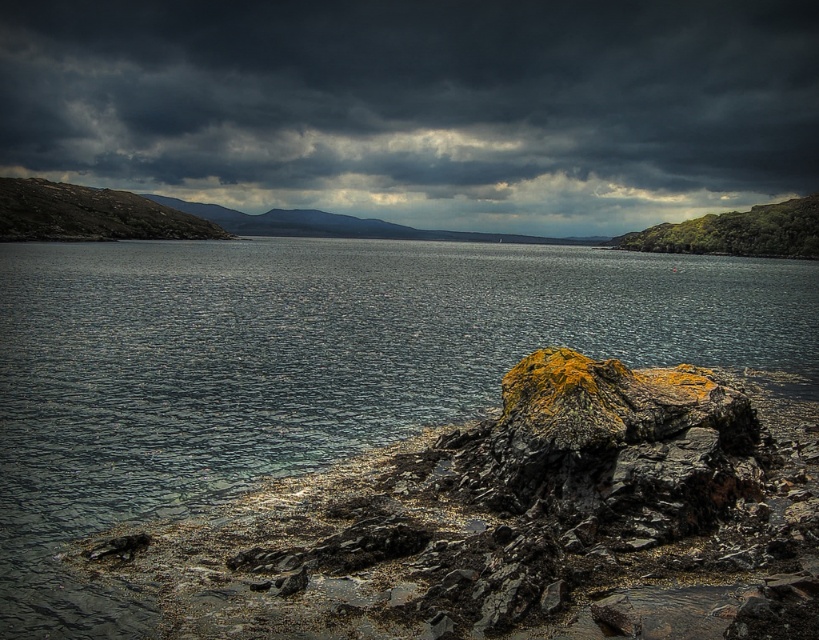
Question: Which point is closer to the camera?

Choices:
 (A) (677, 170)
 (B) (265, 276)

Answer: (B)

Question: From the image, what is the correct spatial relationship of dark gray cloud at upper center in relation to dark gray water at center?

Choices:
 (A) left
 (B) right

Answer: (A)

Question: From the image, what is the correct spatial relationship of dark gray cloud at upper center in relation to dark gray water at center?

Choices:
 (A) above
 (B) below

Answer: (A)

Question: In this image, where is dark gray cloud at upper center located relative to dark gray water at center?

Choices:
 (A) right
 (B) left

Answer: (B)

Question: Which point appears farthest from the camera in this image?

Choices:
 (A) (396, 220)
 (B) (618, 289)

Answer: (A)